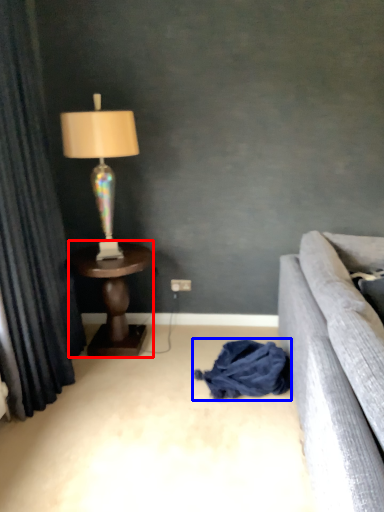
Question: Which object appears farthest to the camera in this image, table (highlighted by a red box) or material (highlighted by a blue box)?

Choices:
 (A) table
 (B) material

Answer: (A)